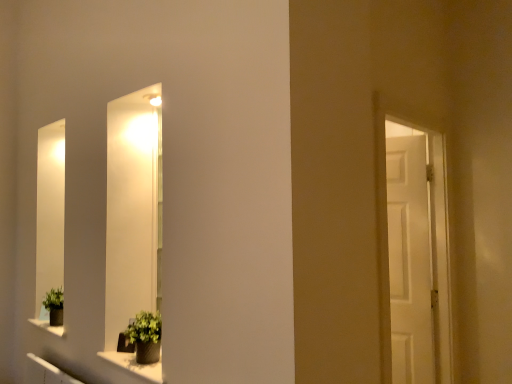
Question: Is matte gray stone window sill at lower center turned away from green matte plant pot at lower left, positioned as the 2th houseplant in back-to-front order?

Choices:
 (A) yes
 (B) no

Answer: (B)

Question: Is matte gray stone window sill at lower center at the left side of green matte plant pot at lower left, positioned as the 2th houseplant in back-to-front order?

Choices:
 (A) yes
 (B) no

Answer: (B)

Question: Can we say matte gray stone window sill at lower center lies outside green matte plant pot at lower left, positioned as the 2th houseplant in back-to-front order?

Choices:
 (A) yes
 (B) no

Answer: (A)

Question: Can green matte plant pot at lower left, the 2th houseplant when ordered from left to right, be found inside matte gray stone window sill at lower center?

Choices:
 (A) no
 (B) yes

Answer: (A)

Question: Does matte gray stone window sill at lower center have a lesser width compared to green matte plant pot at lower left, positioned as the 2th houseplant in back-to-front order?

Choices:
 (A) yes
 (B) no

Answer: (A)

Question: Considering the positions of matte gray stone window sill at lower center and green matte plant at lower left, arranged as the 2th houseplant when viewed from the front, in the image, is matte gray stone window sill at lower center taller or shorter than green matte plant at lower left, arranged as the 2th houseplant when viewed from the front,?

Choices:
 (A) tall
 (B) short

Answer: (B)

Question: From a real-world perspective, is matte gray stone window sill at lower center physically located above or below green matte plant at lower left, which is counted as the first houseplant, starting from the left?

Choices:
 (A) below
 (B) above

Answer: (A)

Question: Is matte gray stone window sill at lower center inside the boundaries of green matte plant at lower left, which is counted as the first houseplant, starting from the left, or outside?

Choices:
 (A) outside
 (B) inside

Answer: (A)

Question: From the image's perspective, is matte gray stone window sill at lower center above or below green matte plant at lower left, the second houseplant viewed from the right?

Choices:
 (A) below
 (B) above

Answer: (A)

Question: Is green matte plant pot at lower left, arranged as the 1th houseplant when viewed from the front, situated inside matte gray stone window sill at lower center or outside?

Choices:
 (A) inside
 (B) outside

Answer: (B)

Question: From a real-world perspective, relative to matte gray stone window sill at lower center, is green matte plant pot at lower left, which ranks as the 1th houseplant in right-to-left order, vertically above or below?

Choices:
 (A) above
 (B) below

Answer: (A)

Question: Relative to matte gray stone window sill at lower center, is green matte plant pot at lower left, which ranks as the 1th houseplant in right-to-left order, in front or behind?

Choices:
 (A) behind
 (B) front

Answer: (A)

Question: Considering the positions of point (129, 336) and point (145, 370), is point (129, 336) closer or farther from the camera than point (145, 370)?

Choices:
 (A) farther
 (B) closer

Answer: (A)

Question: Based on their positions, is green matte plant at lower left, the 1th houseplant when ordered from back to front, located to the left or right of green matte plant pot at lower left, arranged as the 1th houseplant when viewed from the front?

Choices:
 (A) left
 (B) right

Answer: (A)

Question: From a real-world perspective, relative to green matte plant pot at lower left, which ranks as the 1th houseplant in right-to-left order, is green matte plant at lower left, which is counted as the first houseplant, starting from the left, vertically above or below?

Choices:
 (A) below
 (B) above

Answer: (A)